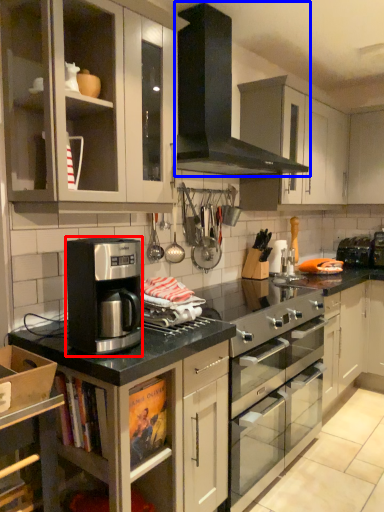
Question: Which point is further to the camera, kitchen appliance (highlighted by a red box) or gas stove (highlighted by a blue box)?

Choices:
 (A) kitchen appliance
 (B) gas stove

Answer: (B)